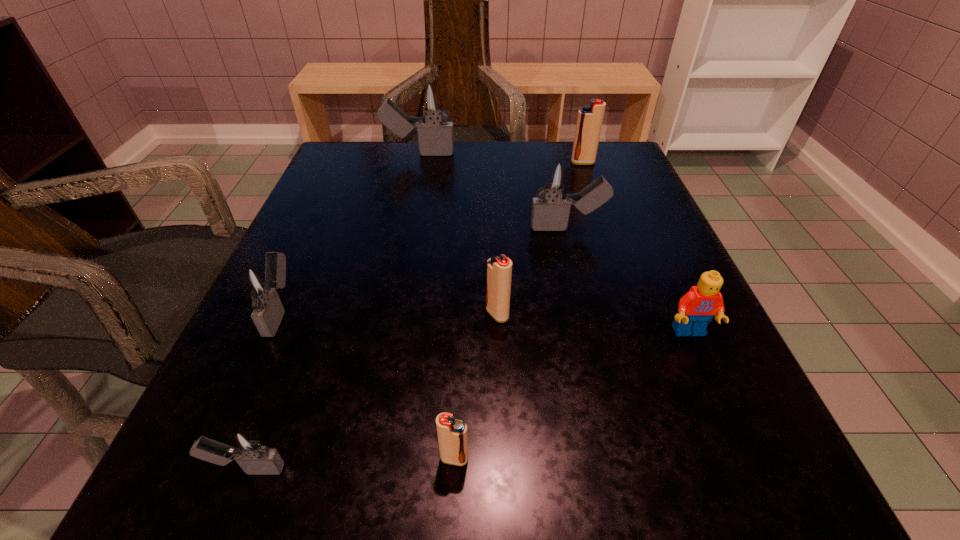
In the image, there is a desktop. Where is `vacant space at the near left corner`? This screenshot has width=960, height=540. vacant space at the near left corner is located at coordinates (310, 462).

Identify the location of free spot between the second nearest gray igniter and the second biggest red igniter. (389, 312).

At what (x,y) coordinates should I click in order to perform the action: click on vacant space in between the tallest igniter and the leftmost red igniter. Please return your answer as a coordinate pair (x, y). Looking at the image, I should click on point(437,306).

At what (x,y) coordinates should I click in order to perform the action: click on empty space between the second smallest gray igniter and the farthest red igniter. Please return your answer as a coordinate pair (x, y). Looking at the image, I should click on (432, 237).

Where is `vacant area that lies between the fourth object from left to right and the biggest gray igniter`? Image resolution: width=960 pixels, height=540 pixels. vacant area that lies between the fourth object from left to right and the biggest gray igniter is located at coordinates (437, 306).

The image size is (960, 540). Identify the location of vacant space that is in between the second nearest gray igniter and the nearest gray igniter. (264, 390).

The width and height of the screenshot is (960, 540). Find the location of `vacant point located between the third farthest gray igniter and the Lego`. vacant point located between the third farthest gray igniter and the Lego is located at coordinates (485, 321).

Where is `vacant point located between the tallest igniter and the farthest red igniter`? Image resolution: width=960 pixels, height=540 pixels. vacant point located between the tallest igniter and the farthest red igniter is located at coordinates (501, 158).

Find the location of a particular element. free point between the farthest gray igniter and the third biggest gray igniter is located at coordinates [349, 232].

This screenshot has height=540, width=960. What are the coordinates of `vacant region between the third biggest gray igniter and the farthest gray igniter` in the screenshot? It's located at (349, 232).